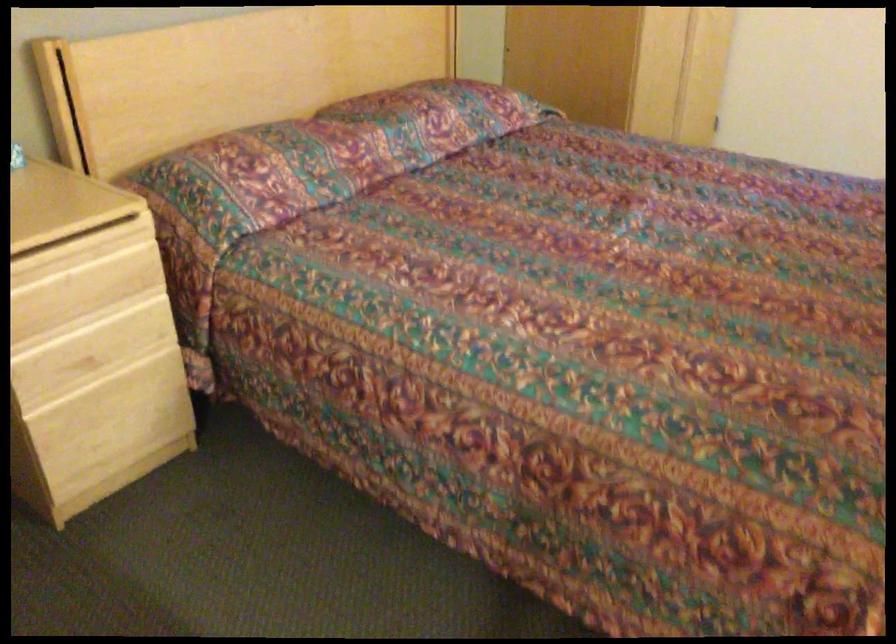
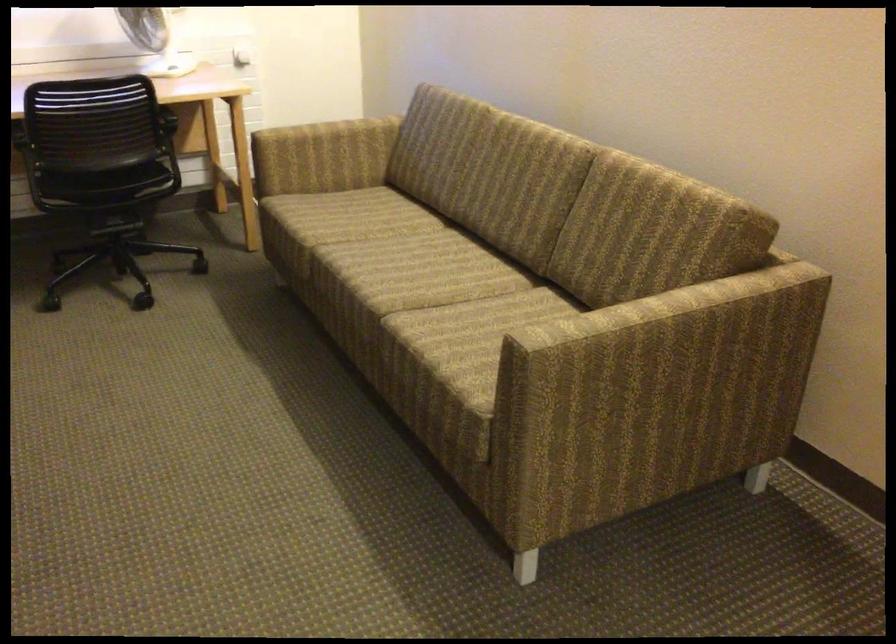
Question: How did the camera likely rotate?

Choices:
 (A) Left
 (B) Right
 (C) Up
 (D) Down

Answer: (B)